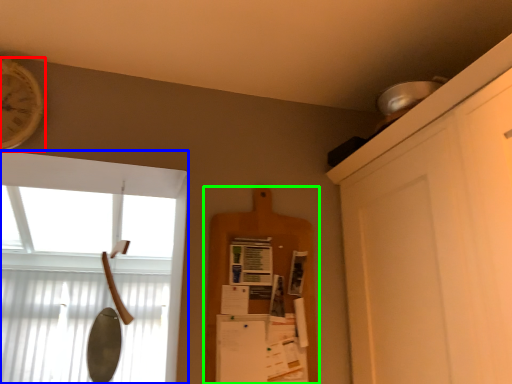
Question: Which object is positioned farthest from clock (highlighted by a red box)? Select from window (highlighted by a blue box) and shelf (highlighted by a green box).

Choices:
 (A) window
 (B) shelf

Answer: (A)